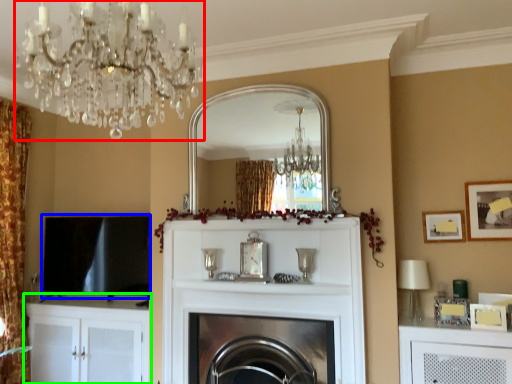
Question: Considering the real-world distances, which object is closest to light fixture (highlighted by a red box)? window screen (highlighted by a blue box) or cabinetry (highlighted by a green box).

Choices:
 (A) window screen
 (B) cabinetry

Answer: (A)